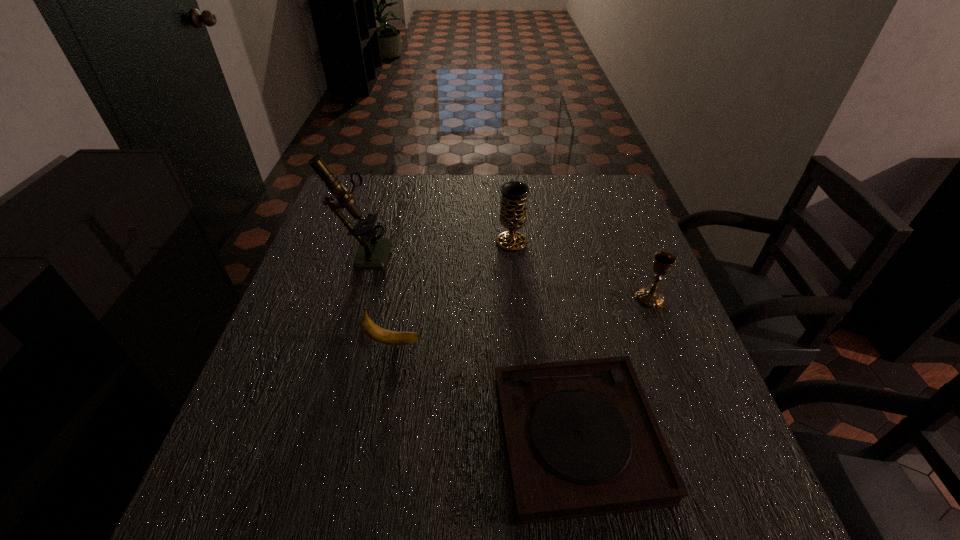
Locate an element on the screen. The width and height of the screenshot is (960, 540). free point that satisfies the following two spatial constraints: 1. at the start of the peel on the nearest object; 2. on the left side of the banana is located at coordinates (376, 437).